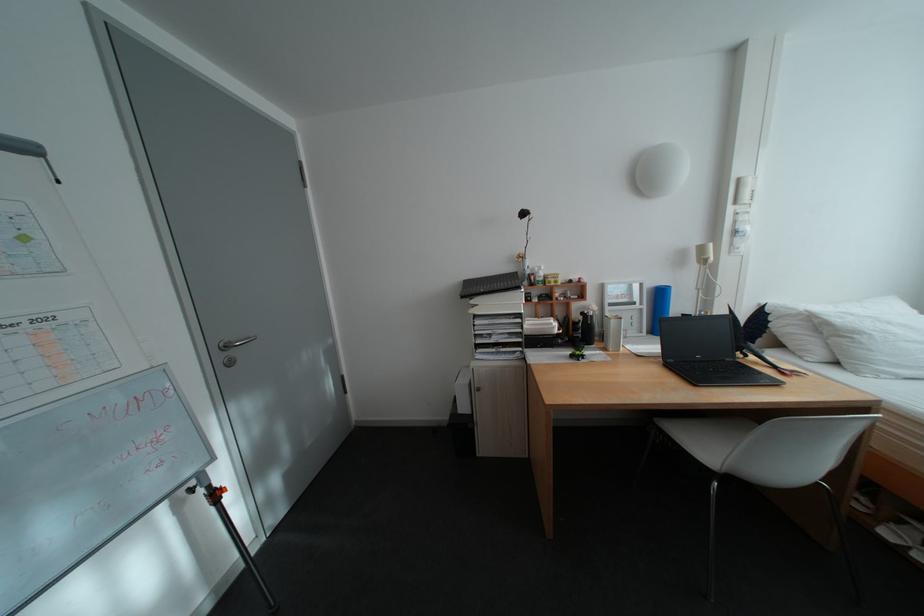
Where would you sit the white chair sitting surface? Please return your answer as a coordinate pair (x, y).

(708, 437)